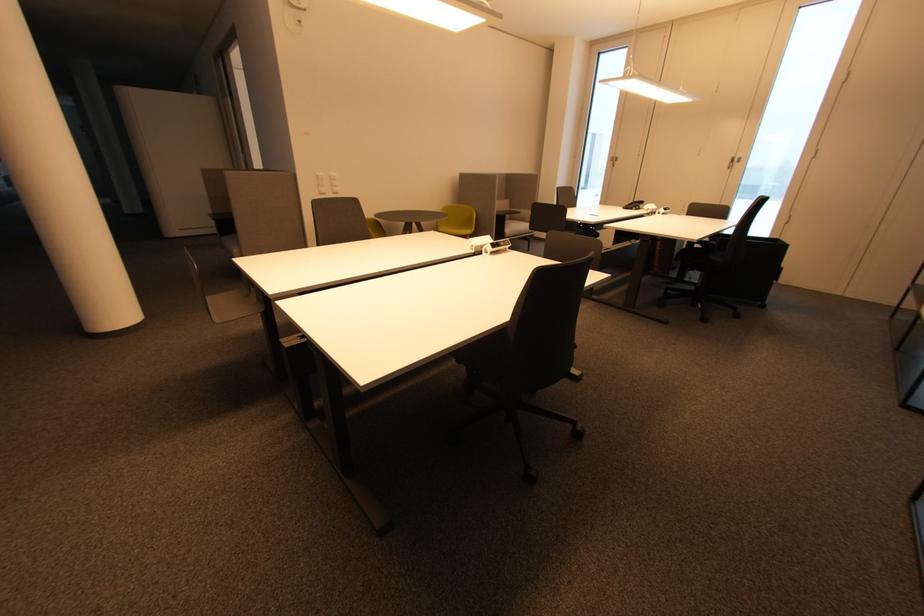
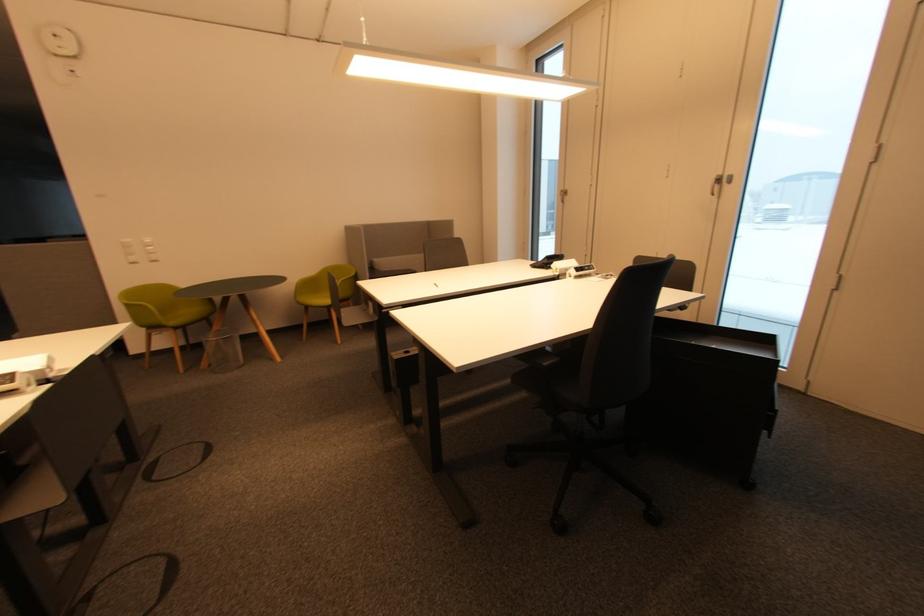
In a continuous first-person perspective shot, in which direction is the camera moving?

The movement direction of the cameraman is right, forward.